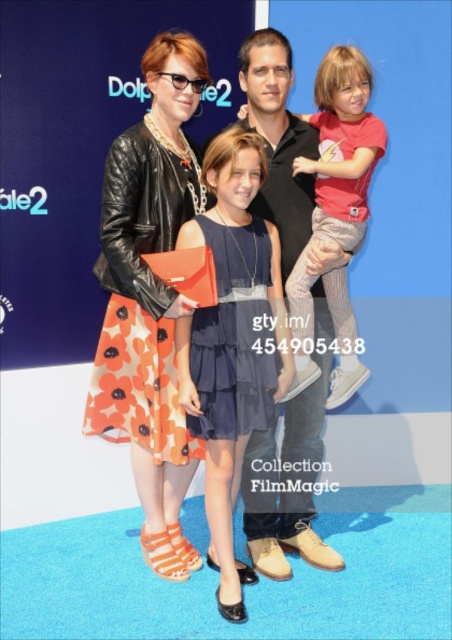
Where is the leather jacket at center located in the image?

The leather jacket at center is located at point (150, 298).

You are a stylist observing the family at the movie premiere. You notice two central items of clothing worn by the adults. The leather jacket at center and the suede black shirt at center. Which clothing item is positioned to the left?

The leather jacket at center is to the left of the suede black shirt at center, so the leather jacket at center is positioned to the left.

You are a photographer at the event and need to ensure the orange floral dress at center is fully visible in the photo. Given that the matte black jacket at center is currently covering part of it, what adjustment should you suggest to the person wearing them?

The matte black jacket at center is positioned over the orange floral dress at center, so the person should adjust their posture to move the jacket aside or remove it slightly to expose more of the dress.